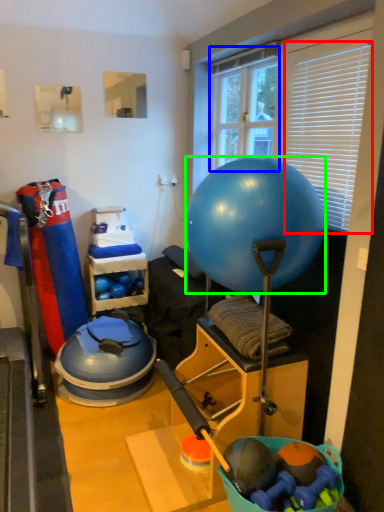
Question: Which object is positioned farthest from blind (highlighted by a red box)? Select from window screen (highlighted by a blue box) and ball (highlighted by a green box).

Choices:
 (A) window screen
 (B) ball

Answer: (A)